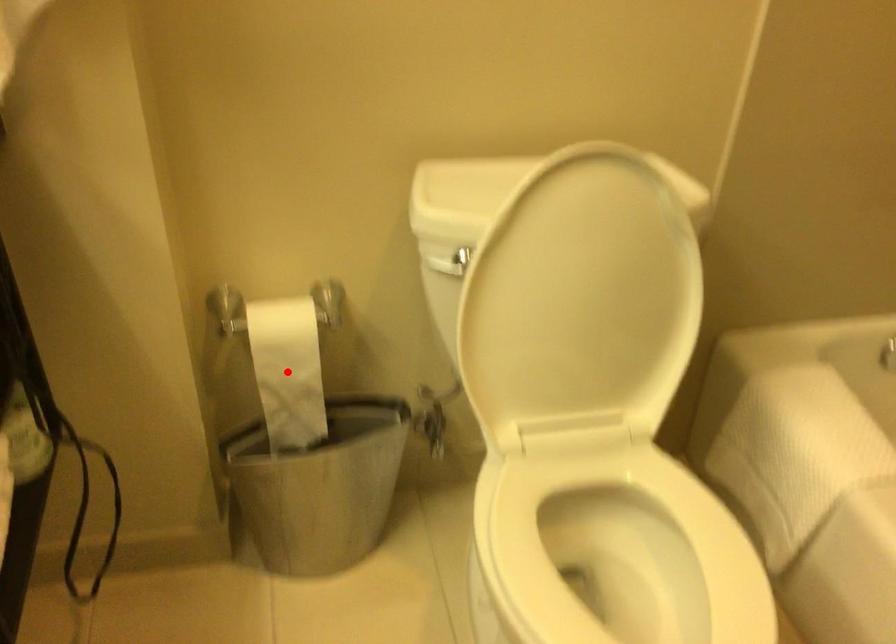
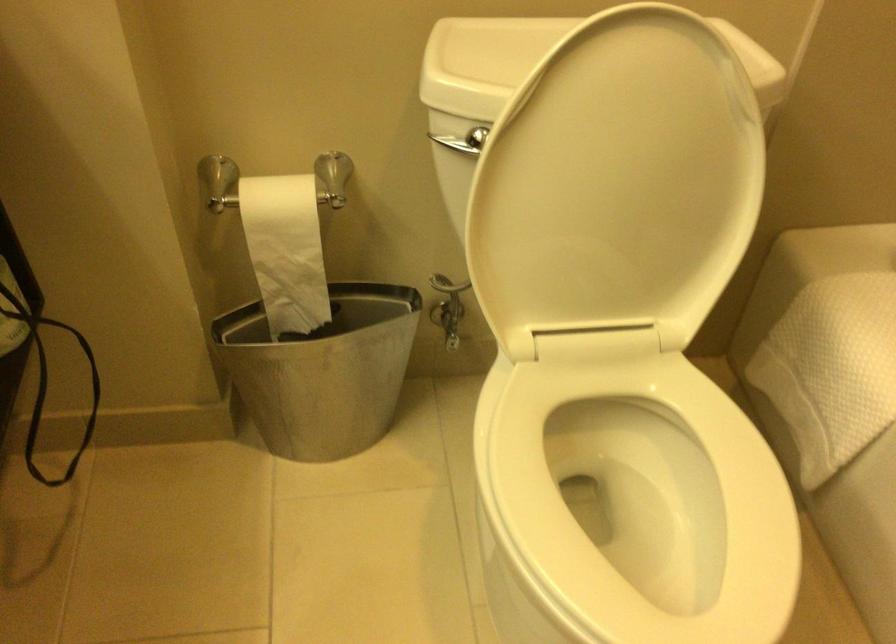
Find the pixel in the second image that matches the highlighted location in the first image.

(286, 250)